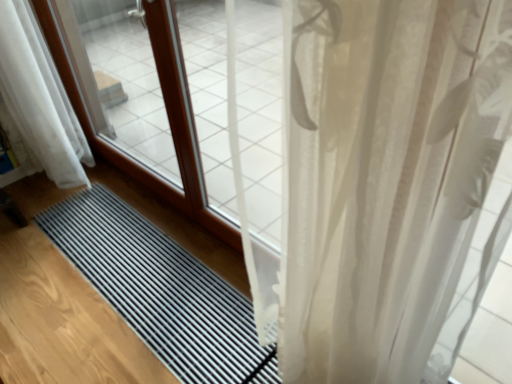
Question: Considering the relative sizes of translucent white curtain at right, arranged as the first curtain when viewed from the right, and white sheer curtain at lower left, which appears as the first curtain when viewed from the back, in the image provided, is translucent white curtain at right, arranged as the first curtain when viewed from the right, bigger than white sheer curtain at lower left, which appears as the first curtain when viewed from the back,?

Choices:
 (A) yes
 (B) no

Answer: (B)

Question: Is translucent white curtain at right, marked as the second curtain in a back-to-front arrangement, aimed at white sheer curtain at lower left, the second curtain when ordered from right to left?

Choices:
 (A) no
 (B) yes

Answer: (A)

Question: From the image's perspective, is translucent white curtain at right, which is the first curtain in front-to-back order, above white sheer curtain at lower left, which appears as the first curtain when viewed from the back?

Choices:
 (A) no
 (B) yes

Answer: (A)

Question: Considering the relative sizes of translucent white curtain at right, marked as the second curtain in a back-to-front arrangement, and white sheer curtain at lower left, which appears as the first curtain when viewed from the back, in the image provided, is translucent white curtain at right, marked as the second curtain in a back-to-front arrangement, smaller than white sheer curtain at lower left, which appears as the first curtain when viewed from the back,?

Choices:
 (A) yes
 (B) no

Answer: (A)

Question: Can you confirm if translucent white curtain at right, arranged as the first curtain when viewed from the right, is wider than white sheer curtain at lower left, positioned as the second curtain in front-to-back order?

Choices:
 (A) no
 (B) yes

Answer: (A)

Question: From a real-world perspective, relative to white sheer curtain at lower left, which appears as the first curtain when viewed from the back, is black rubber mat at center vertically above or below?

Choices:
 (A) above
 (B) below

Answer: (B)

Question: Relative to white sheer curtain at lower left, the second curtain when ordered from right to left, is black rubber mat at center in front or behind?

Choices:
 (A) front
 (B) behind

Answer: (A)

Question: Is black rubber mat at center bigger or smaller than white sheer curtain at lower left, the second curtain when ordered from right to left?

Choices:
 (A) big
 (B) small

Answer: (B)

Question: Is black rubber mat at center wider or thinner than white sheer curtain at lower left, which appears as the first curtain when viewed from the back?

Choices:
 (A) thin
 (B) wide

Answer: (B)

Question: Considering their positions, is translucent white curtain at right, arranged as the first curtain when viewed from the right, located in front of or behind black rubber mat at center?

Choices:
 (A) behind
 (B) front

Answer: (B)

Question: From a real-world perspective, is translucent white curtain at right, marked as the second curtain in a back-to-front arrangement, above or below black rubber mat at center?

Choices:
 (A) below
 (B) above

Answer: (B)

Question: Is point (471, 314) positioned closer to the camera than point (124, 311)?

Choices:
 (A) closer
 (B) farther

Answer: (A)

Question: In the image, is translucent white curtain at right, marked as the second curtain in a back-to-front arrangement, on the left side or the right side of black rubber mat at center?

Choices:
 (A) left
 (B) right

Answer: (B)

Question: Do you think black rubber mat at center is within translucent white curtain at right, which is the first curtain in front-to-back order, or outside of it?

Choices:
 (A) inside
 (B) outside

Answer: (B)

Question: From the image's perspective, is black rubber mat at center above or below translucent white curtain at right, which is the first curtain in front-to-back order?

Choices:
 (A) below
 (B) above

Answer: (A)